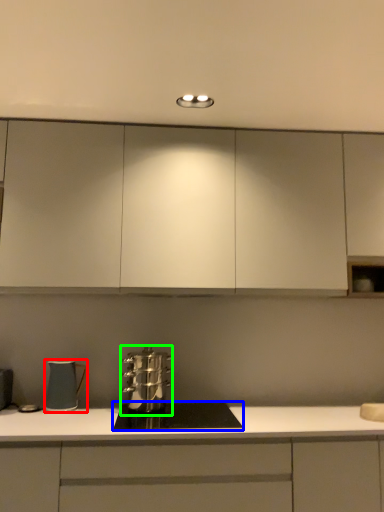
Question: Considering the real-world distances, which object is farthest from kitchen appliance (highlighted by a red box)? home appliance (highlighted by a blue box) or kitchen appliance (highlighted by a green box)?

Choices:
 (A) home appliance
 (B) kitchen appliance

Answer: (A)